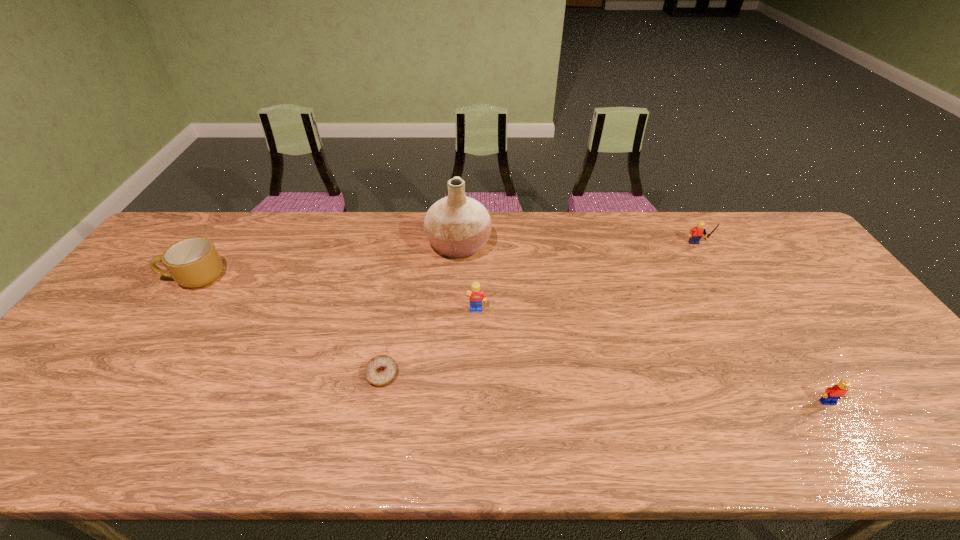
In order to click on free spot located to pour from the handle of the pottery in this screenshot , I will do `click(571, 246)`.

Locate an element on the screen. This screenshot has width=960, height=540. vacant space located on the front-facing side of the second Lego from right to left is located at coordinates [717, 284].

Identify the location of free space located 0.050m on the side with the handle of the leftmost object. The height and width of the screenshot is (540, 960). (149, 278).

Identify the location of blank space located 0.070m on the side with the handle of the leftmost object. (142, 278).

The height and width of the screenshot is (540, 960). What are the coordinates of `vacant space situated 0.240m on the face of the leftmost Lego` in the screenshot? It's located at (476, 393).

In order to click on vacant space situated on the front-facing side of the rightmost object in this screenshot , I will do `click(846, 430)`.

At what (x,y) coordinates should I click in order to perform the action: click on vacant area situated 0.120m on the left of the doughnut. Please return your answer as a coordinate pair (x, y). This screenshot has width=960, height=540. Looking at the image, I should click on (318, 374).

You are a GUI agent. You are given a task and a screenshot of the screen. Output one action in this format:
    pyautogui.click(x=<x>, y=<y>)
    Task: Click on the pottery that is at the far edge
    The image size is (960, 540).
    Given the screenshot: What is the action you would take?
    pyautogui.click(x=458, y=226)

Locate an element on the screen. This screenshot has width=960, height=540. Lego situated at the far edge is located at coordinates (696, 233).

At what (x,y) coordinates should I click in order to perform the action: click on object that is at the left edge. Please return your answer as a coordinate pair (x, y). Looking at the image, I should click on (194, 262).